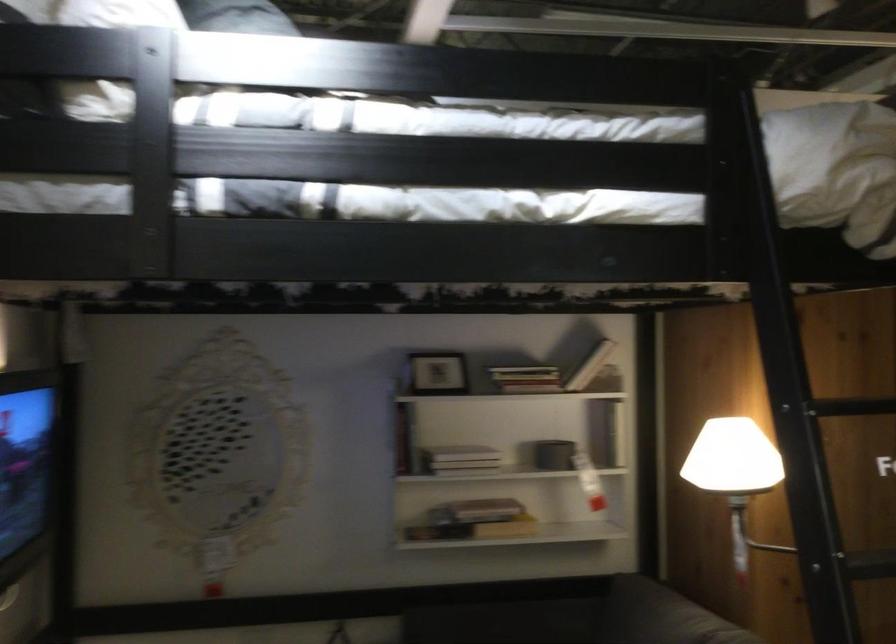
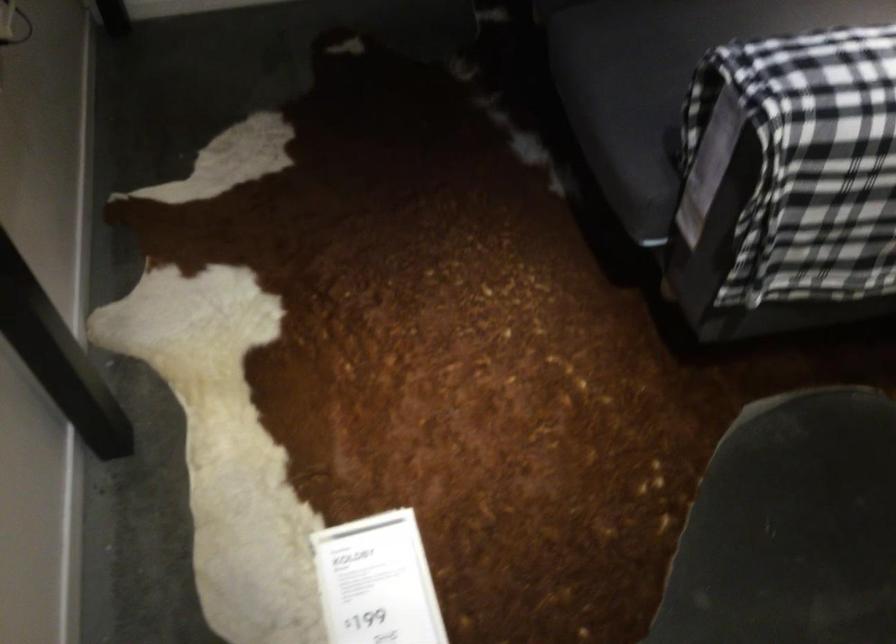
Question: The first image is from the beginning of the video and the second image is from the end. How did the camera likely rotate when shooting the video?

Choices:
 (A) Left
 (B) Right
 (C) Up
 (D) Down

Answer: (D)